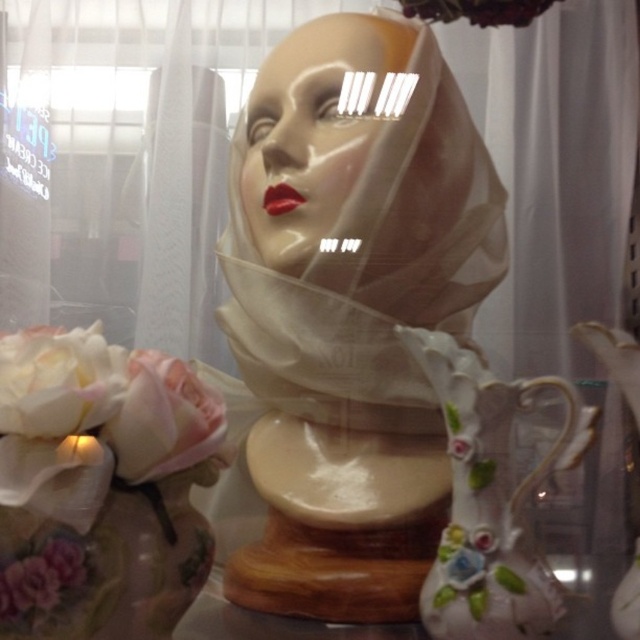
Question: Which of the following is the closest to the observer?

Choices:
 (A) white silk flower at lower left
 (B) translucent floral-patterned vase at lower left
 (C) pink fabric flower at lower left

Answer: (A)

Question: Can you confirm if white porcelain flower at lower left is bigger than pink fabric flower at lower left?

Choices:
 (A) yes
 (B) no

Answer: (A)

Question: Which of the following is the closest to the observer?

Choices:
 (A) (125, 596)
 (B) (186, 368)
 (C) (141, 404)

Answer: (C)

Question: Can you confirm if matte plastic face at center is wider than white silk flower at lower left?

Choices:
 (A) yes
 (B) no

Answer: (A)

Question: Does matte white bust at center appear over translucent floral-patterned vase at lower left?

Choices:
 (A) yes
 (B) no

Answer: (A)

Question: Which point is farther to the camera?

Choices:
 (A) pyautogui.click(x=170, y=369)
 (B) pyautogui.click(x=120, y=424)

Answer: (A)